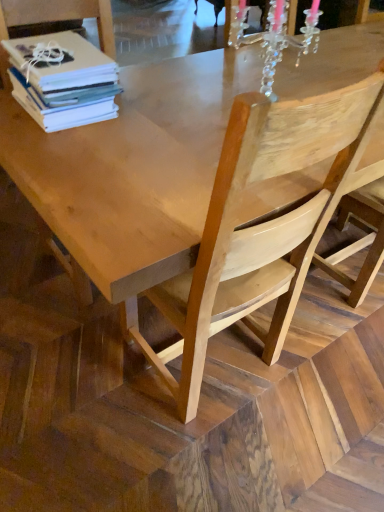
The width and height of the screenshot is (384, 512). What are the coordinates of `free area in between white paper stack at upper left and clear crystal chandelier at upper center` in the screenshot? It's located at (170, 108).